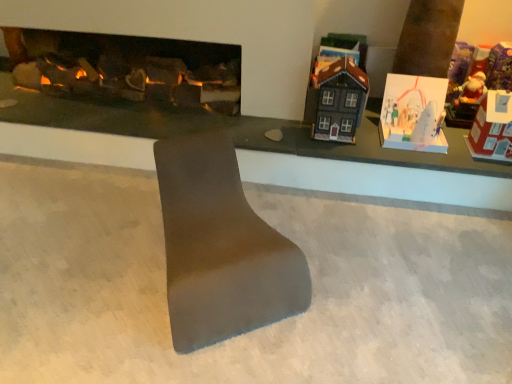
You are a GUI agent. You are given a task and a screenshot of the screen. Output one action in this format:
    pyautogui.click(x=<x>, y=<y>)
    Task: Click on the vacant region to the right of dark gray matte house at upper right, arranged as the fourth toy when viewed from the right
    Image resolution: width=512 pixels, height=384 pixels.
    Given the screenshot: What is the action you would take?
    pyautogui.click(x=373, y=135)